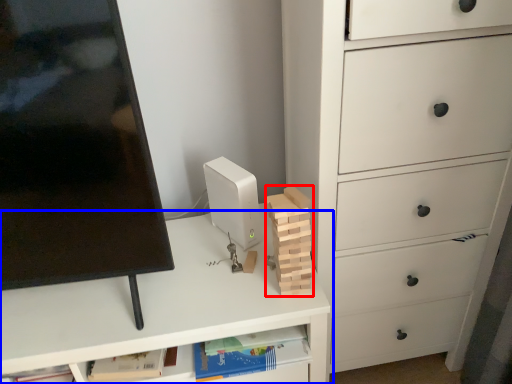
Question: Which point is closer to the camera, block (highlighted by a red box) or desk (highlighted by a blue box)?

Choices:
 (A) block
 (B) desk

Answer: (A)